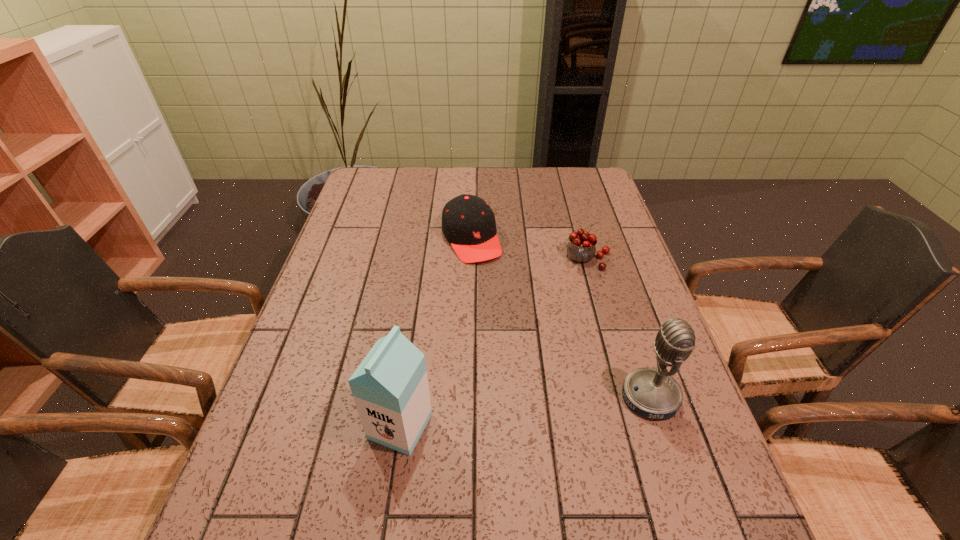
Locate an element on the screen. the closest object to the milk carton is located at coordinates (654, 393).

Locate an element on the screen. the closest object relative to the milk carton is located at coordinates click(x=654, y=393).

Identify the location of vacant space that satisfies the following two spatial constraints: 1. on the back side of the cap; 2. on the left side of the milk carton. This screenshot has height=540, width=960. (427, 239).

You are a GUI agent. You are given a task and a screenshot of the screen. Output one action in this format:
    pyautogui.click(x=<x>, y=<y>)
    Task: Click on the vacant region that satisfies the following two spatial constraints: 1. on the front side of the pot filled with cherries; 2. on the right side of the cap
    The width and height of the screenshot is (960, 540).
    Given the screenshot: What is the action you would take?
    pyautogui.click(x=470, y=259)

Find the location of `vacant space that satisfies the following two spatial constraints: 1. on the front side of the microphone; 2. on the front-facing side of the pot filled with cherries`. vacant space that satisfies the following two spatial constraints: 1. on the front side of the microphone; 2. on the front-facing side of the pot filled with cherries is located at coordinates (x=626, y=397).

What are the coordinates of `free spot that satisfies the following two spatial constraints: 1. on the front side of the microphone; 2. on the front-facing side of the cap` in the screenshot? It's located at pyautogui.click(x=468, y=397).

You are a GUI agent. You are given a task and a screenshot of the screen. Output one action in this format:
    pyautogui.click(x=<x>, y=<y>)
    Task: Click on the free point that satisfies the following two spatial constraints: 1. on the front side of the microphone; 2. on the front-facing side of the cap
    Image resolution: width=960 pixels, height=540 pixels.
    Given the screenshot: What is the action you would take?
    [468, 397]